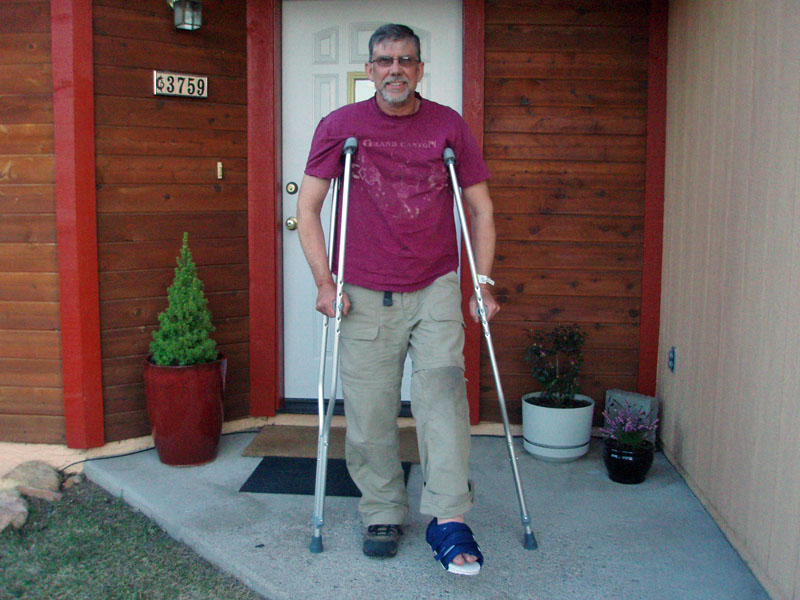
At what (x,y) coordinates should I click in order to perform the action: click on door knob. Please return your answer as a coordinate pair (x, y). This screenshot has height=600, width=800. Looking at the image, I should click on (288, 224).